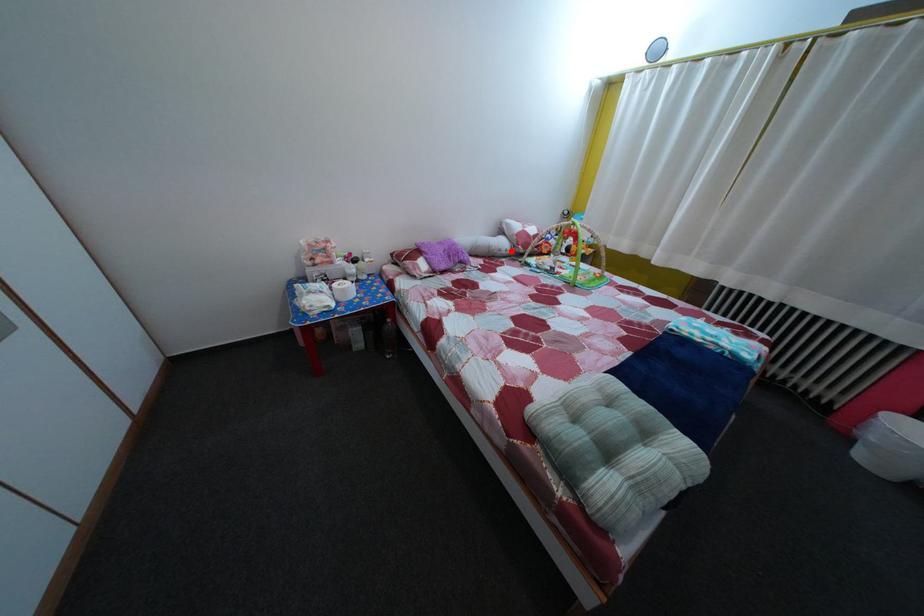
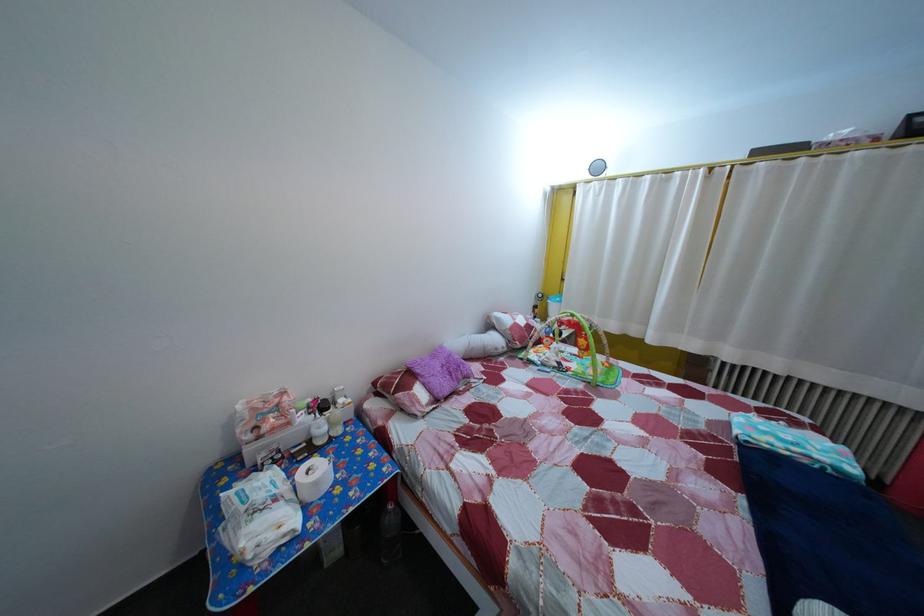
Locate, in the second image, the point that corresponds to the highlighted location in the first image.

(505, 347)